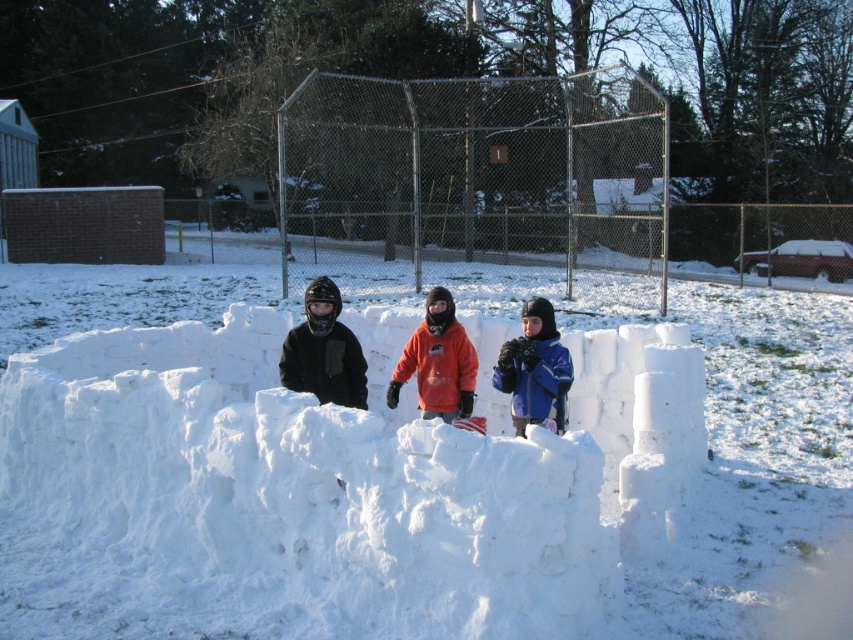
You are a photographer trying to capture a group photo of the children. You need to ensure that both the matte black jacket at center and the orange fleece jacket at center are in focus. Given that your camera has a depth of field that can cover 25 inches, will both children be in focus?

The distance between the matte black jacket at center and orange fleece jacket at center is 24.87 inches, which is within the camera depth of field of 25 inches. Therefore, both children will be in focus.

You are a photographer trying to capture the children and the snow castle in the winter scene. You want to ensure that the child wearing the matte black jacket at center is positioned exactly at point (323, 352) in your frame. Based on the scene description, can you confirm if this is possible?

Yes, the matte black jacket at center is located at point (323, 352), so positioning the child wearing it at that point in the frame is possible.